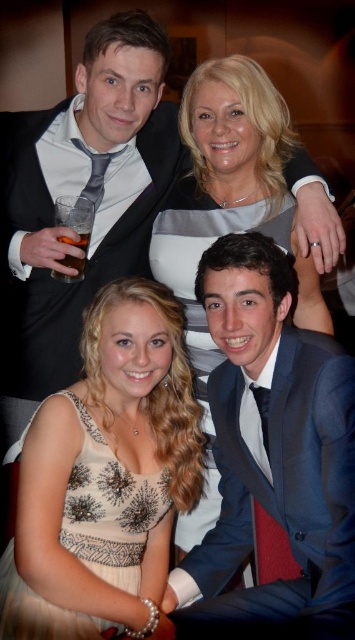
Question: Which of the following is the farthest from the observer?

Choices:
 (A) sequined fabric dress at lower left
 (B) blue satin suit at lower right

Answer: (A)

Question: Can you confirm if blue satin suit at upper center is wider than beige sequined dress at lower left?

Choices:
 (A) yes
 (B) no

Answer: (A)

Question: Is blue satin suit at upper center above sequined fabric dress at lower left?

Choices:
 (A) no
 (B) yes

Answer: (B)

Question: Among these points, which one is farthest from the camera?

Choices:
 (A) (157, 276)
 (B) (134, 250)
 (C) (0, 593)
 (D) (312, 595)

Answer: (B)

Question: Which point is farther to the camera?

Choices:
 (A) (314, 580)
 (B) (170, 250)
 (C) (53, 605)
 (D) (319, 202)

Answer: (B)

Question: Does blue satin suit at upper center appear over translucent glass at upper left?

Choices:
 (A) no
 (B) yes

Answer: (B)